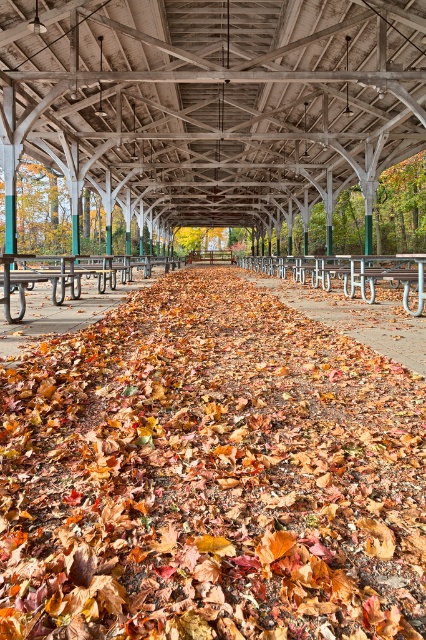
You are a painter standing at the entrance of the walkway. You want to paint the wooden picnic table at center without getting paint on the wooden beams at center. What should you be cautious about?

The wooden beams at center are above the wooden picnic table at center, so you should be cautious not to let paint splatter upwards onto the beams.